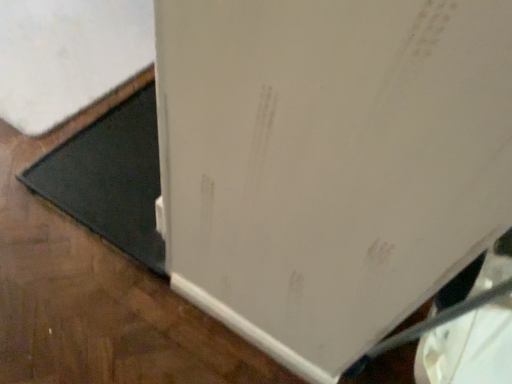
Question: Should I look upward or downward to see white matte refrigerator at lower right?

Choices:
 (A) up
 (B) down

Answer: (A)

Question: Is black rubber doormat at lower left shorter than white matte refrigerator at lower right?

Choices:
 (A) no
 (B) yes

Answer: (A)

Question: Considering the relative sizes of black rubber doormat at lower left and white matte refrigerator at lower right in the image provided, is black rubber doormat at lower left smaller than white matte refrigerator at lower right?

Choices:
 (A) yes
 (B) no

Answer: (A)

Question: Considering the relative positions of black rubber doormat at lower left and white matte refrigerator at lower right in the image provided, is black rubber doormat at lower left to the right of white matte refrigerator at lower right from the viewer's perspective?

Choices:
 (A) no
 (B) yes

Answer: (B)

Question: Does black rubber doormat at lower left touch white matte refrigerator at lower right?

Choices:
 (A) yes
 (B) no

Answer: (B)

Question: Is black rubber doormat at lower left not inside white matte refrigerator at lower right?

Choices:
 (A) no
 (B) yes

Answer: (A)

Question: Would you say black rubber doormat at lower left contains white matte refrigerator at lower right?

Choices:
 (A) yes
 (B) no

Answer: (B)

Question: From a real-world perspective, does white matte refrigerator at lower right stand above black rubber doormat at lower left?

Choices:
 (A) no
 (B) yes

Answer: (A)

Question: Is white matte refrigerator at lower right aimed at black rubber doormat at lower left?

Choices:
 (A) no
 (B) yes

Answer: (B)

Question: Is white matte refrigerator at lower right at the left side of black rubber doormat at lower left?

Choices:
 (A) yes
 (B) no

Answer: (A)

Question: Does white matte refrigerator at lower right come behind black rubber doormat at lower left?

Choices:
 (A) yes
 (B) no

Answer: (B)

Question: Considering the relative sizes of white matte refrigerator at lower right and black rubber doormat at lower left in the image provided, is white matte refrigerator at lower right taller than black rubber doormat at lower left?

Choices:
 (A) no
 (B) yes

Answer: (A)

Question: Considering the relative sizes of white matte refrigerator at lower right and black rubber doormat at lower left in the image provided, is white matte refrigerator at lower right wider than black rubber doormat at lower left?

Choices:
 (A) no
 (B) yes

Answer: (B)

Question: From their relative heights in the image, would you say white matte refrigerator at lower right is taller or shorter than black rubber doormat at lower left?

Choices:
 (A) tall
 (B) short

Answer: (B)